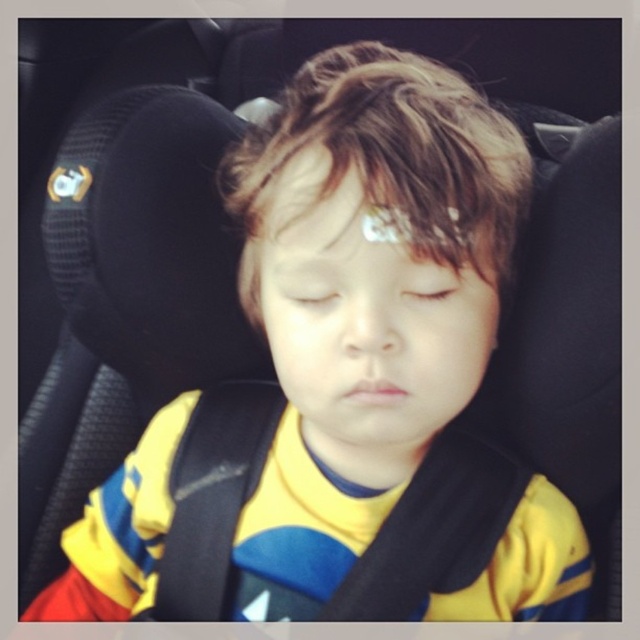
Can you confirm if transparent plastic eye at center is positioned below light brown skin at center?

Correct, transparent plastic eye at center is located below light brown skin at center.

Does transparent plastic eye at center lie in front of light brown skin at center?

No.

Between point (332, 285) and point (440, 289), which one is positioned behind?

The point (440, 289) is more distant.

Find the location of a particular element. transparent plastic eye at center is located at coordinates (310, 292).

Measure the distance between point (328, 218) and camera.

The distance of point (328, 218) from camera is 15.87 inches.

Is point (330, 198) more distant than point (317, 305)?

No, it is not.

This screenshot has width=640, height=640. Identify the location of matte white forehead at center. (365, 212).

Does matte white forehead at center have a smaller size compared to light brown skin at center?

Actually, matte white forehead at center might be larger than light brown skin at center.

Is matte white forehead at center taller than light brown skin at center?

Indeed, matte white forehead at center has a greater height compared to light brown skin at center.

Is point (432, 236) farther from camera compared to point (436, 298)?

No, (432, 236) is in front of (436, 298).

Locate an element on the screen. matte white forehead at center is located at coordinates (365, 212).